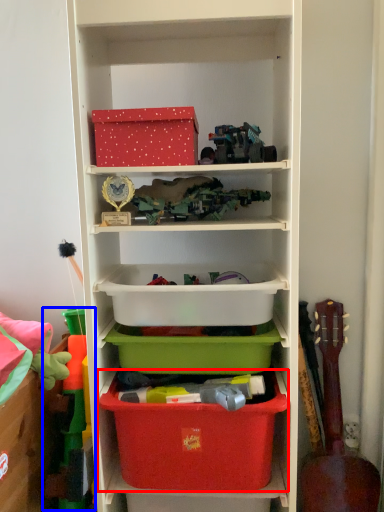
Question: Which object is further to the camera taking this photo, storage box (highlighted by a red box) or toy (highlighted by a blue box)?

Choices:
 (A) storage box
 (B) toy

Answer: (B)